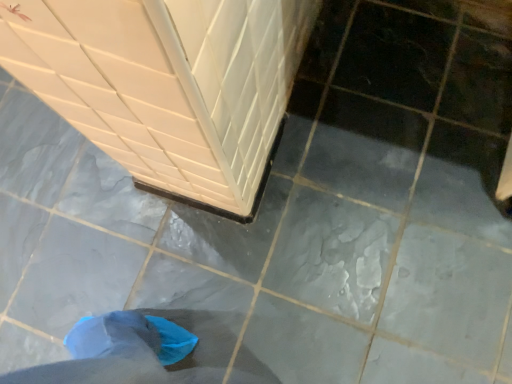
The width and height of the screenshot is (512, 384). I want to click on matte white door at upper left, so click(168, 85).

This screenshot has width=512, height=384. What do you see at coordinates (168, 85) in the screenshot?
I see `matte white door at upper left` at bounding box center [168, 85].

Find the location of `matte white door at upper left`. matte white door at upper left is located at coordinates (168, 85).